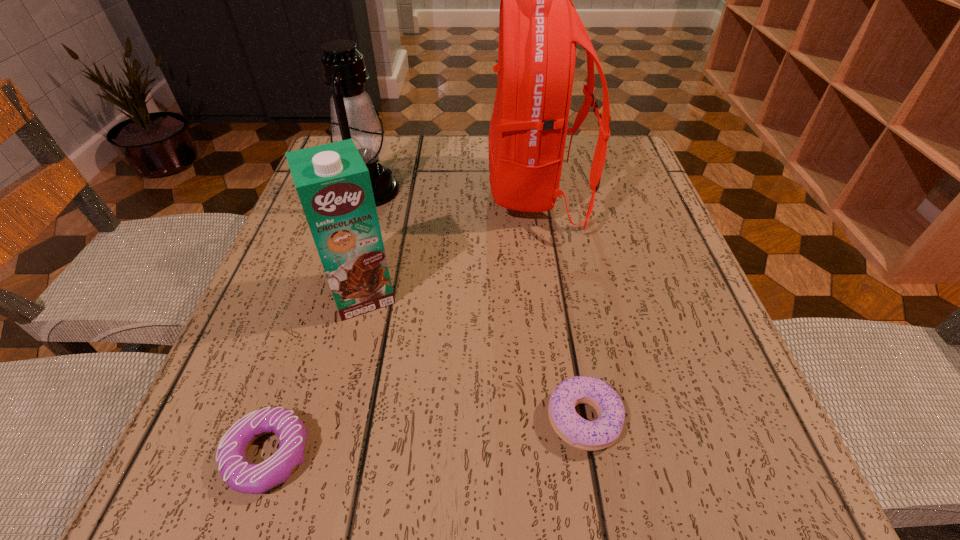
Identify the location of object positioned at the far right corner. (539, 26).

Where is `free space at the far edge of the desktop`? This screenshot has width=960, height=540. free space at the far edge of the desktop is located at coordinates (452, 145).

In the image, there is a desktop. At what (x,y) coordinates should I click in order to perform the action: click on free region at the near edge. Please return your answer as a coordinate pair (x, y). The image size is (960, 540). Looking at the image, I should click on (328, 481).

In the image, there is a desktop. Where is `vacant area at the left edge`? The image size is (960, 540). vacant area at the left edge is located at coordinates (217, 384).

Where is `vacant space at the right edge of the desktop`? Image resolution: width=960 pixels, height=540 pixels. vacant space at the right edge of the desktop is located at coordinates (679, 329).

This screenshot has width=960, height=540. In the image, there is a desktop. Find the location of `vacant space at the far right corner`. vacant space at the far right corner is located at coordinates (586, 168).

This screenshot has height=540, width=960. What are the coordinates of `vacant area between the left doughnut and the oil lamp` in the screenshot? It's located at (319, 323).

Locate an element on the screen. Image resolution: width=960 pixels, height=540 pixels. free space between the left doughnut and the oil lamp is located at coordinates (319, 323).

Locate an element on the screen. The height and width of the screenshot is (540, 960). free spot between the backpack and the carton is located at coordinates (449, 242).

Where is `free space between the third nearest object and the tallest object`? free space between the third nearest object and the tallest object is located at coordinates (449, 242).